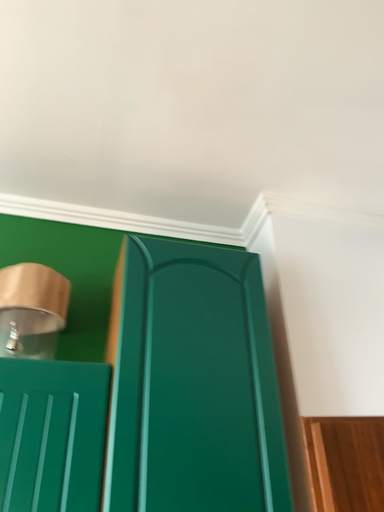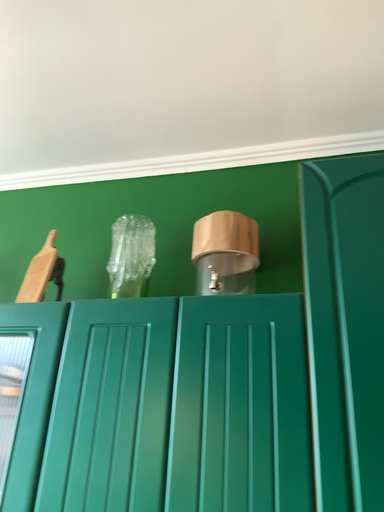
Question: Which way did the camera rotate in the video?

Choices:
 (A) rotated upward
 (B) rotated downward

Answer: (B)